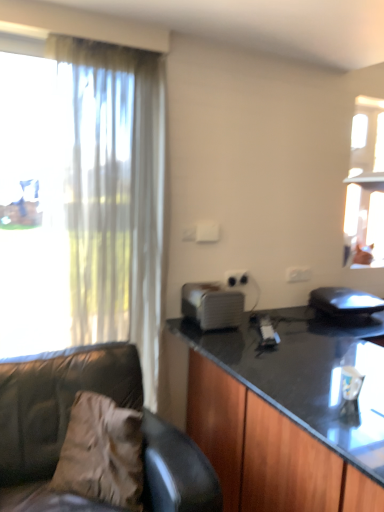
Locate an element on the screen. This screenshot has width=384, height=512. black plastic laptop at right, the first appliance positioned from the right is located at coordinates (344, 301).

The image size is (384, 512). What do you see at coordinates (236, 278) in the screenshot? I see `white plastic power outlet at center` at bounding box center [236, 278].

Where is `translucent fabric curtain at left`? Image resolution: width=384 pixels, height=512 pixels. translucent fabric curtain at left is located at coordinates (112, 193).

What is the approximate width of brown fabric pillow at lower left?

brown fabric pillow at lower left is 11.17 inches in width.

What do you see at coordinates (212, 305) in the screenshot? This screenshot has width=384, height=512. I see `white plastic toaster at center, positioned as the first appliance in left-to-right order` at bounding box center [212, 305].

What is the approximate height of white plastic toaster at center, positioned as the first appliance in left-to-right order?

It is 8.18 inches.

Locate an element on the screen. black plastic laptop at right, positioned as the second appliance in left-to-right order is located at coordinates pos(344,301).

Considering the positions of point (382, 304) and point (311, 465), is point (382, 304) closer or farther from the camera than point (311, 465)?

Clearly, point (382, 304) is more distant from the camera than point (311, 465).

From a real-world perspective, which is physically above, black plastic laptop at right, the first appliance positioned from the right, or black glossy cabinet at right?

In real-world perspective, black plastic laptop at right, the first appliance positioned from the right, is above.

Considering the relative positions of black plastic laptop at right, positioned as the second appliance in left-to-right order, and black glossy cabinet at right in the image provided, is black plastic laptop at right, positioned as the second appliance in left-to-right order, to the right of black glossy cabinet at right from the viewer's perspective?

Correct, you'll find black plastic laptop at right, positioned as the second appliance in left-to-right order, to the right of black glossy cabinet at right.

From the image's perspective, does black plastic laptop at right, the first appliance positioned from the right, appear lower than black glossy cabinet at right?

Actually, black plastic laptop at right, the first appliance positioned from the right, appears above black glossy cabinet at right in the image.

Looking at this image, from a real-world perspective, is translucent fabric curtain at left beneath black glossy cabinet at right?

No, from a real-world perspective, translucent fabric curtain at left is not beneath black glossy cabinet at right.

Which is nearer, (92, 188) or (312, 501)?

Point (92, 188) appears to be farther away from the viewer than point (312, 501).

Does translucent fabric curtain at left appear on the right side of black glossy cabinet at right?

No.

How far apart are translucent fabric curtain at left and black glossy cabinet at right?

translucent fabric curtain at left is 34.01 inches away from black glossy cabinet at right.

From the picture: Could you tell me if brown fabric pillow at lower left is turned towards translucent fabric curtain at left?

No.

From a real-world perspective, does brown fabric pillow at lower left stand above translucent fabric curtain at left?

No, from a real-world perspective, brown fabric pillow at lower left is not over translucent fabric curtain at left

Find the location of a particular element. This screenshot has width=384, height=512. pillow lying below the translucent fabric curtain at left (from the image's perspective) is located at coordinates (102, 452).

Can you see brown fabric pillow at lower left touching translucent fabric curtain at left?

No, brown fabric pillow at lower left is not next to translucent fabric curtain at left.

Is black plastic laptop at right, the first appliance positioned from the right, aimed at leather couch at left?

No, black plastic laptop at right, the first appliance positioned from the right, is not oriented towards leather couch at left.

Does black plastic laptop at right, positioned as the second appliance in left-to-right order, have a lesser height compared to leather couch at left?

Indeed, black plastic laptop at right, positioned as the second appliance in left-to-right order, has a lesser height compared to leather couch at left.

Measure the distance from black plastic laptop at right, positioned as the second appliance in left-to-right order, to leather couch at left.

5.24 feet.

In the scene shown: Is black plastic laptop at right, the first appliance positioned from the right, closer to the viewer compared to leather couch at left?

No, black plastic laptop at right, the first appliance positioned from the right, is further to the viewer.

From a real-world perspective, does white plastic toaster at center, positioned as the first appliance in left-to-right order, stand above white plastic power outlet at center?

No, from a real-world perspective, white plastic toaster at center, positioned as the first appliance in left-to-right order, is not over white plastic power outlet at center

Is white plastic toaster at center, positioned as the first appliance in left-to-right order, thinner than white plastic power outlet at center?

Incorrect, the width of white plastic toaster at center, positioned as the first appliance in left-to-right order, is not less than that of white plastic power outlet at center.

Does point (211, 319) come behind point (235, 275)?

No.

Find the location of a particular element. The width and height of the screenshot is (384, 512). the 2nd appliance in front of the white plastic power outlet at center, counting from the anchor's position is located at coordinates (212, 305).

Does point (230, 272) come farther from viewer compared to point (136, 402)?

Yes, point (230, 272) is farther from viewer.

Can you confirm if white plastic power outlet at center is thinner than leather couch at left?

Correct, the width of white plastic power outlet at center is less than that of leather couch at left.

Is white plastic power outlet at center directly adjacent to leather couch at left?

No.

Considering the relative sizes of white plastic power outlet at center and leather couch at left in the image provided, is white plastic power outlet at center taller than leather couch at left?

In fact, white plastic power outlet at center may be shorter than leather couch at left.

Consider the image. Is brown fabric pillow at lower left not within black plastic laptop at right, positioned as the second appliance in left-to-right order?

That's correct, brown fabric pillow at lower left is outside of black plastic laptop at right, positioned as the second appliance in left-to-right order.

Does brown fabric pillow at lower left appear on the left side of black plastic laptop at right, positioned as the second appliance in left-to-right order?

Yes, brown fabric pillow at lower left is to the left of black plastic laptop at right, positioned as the second appliance in left-to-right order.

From a real-world perspective, which is physically above, brown fabric pillow at lower left or black plastic laptop at right, the first appliance positioned from the right?

black plastic laptop at right, the first appliance positioned from the right, from a real-world perspective.

Which is behind, point (73, 436) or point (340, 293)?

The point (340, 293) is farther.

The height and width of the screenshot is (512, 384). I want to click on the 1st appliance above the black glossy cabinet at right (from a real-world perspective), so click(x=344, y=301).

Image resolution: width=384 pixels, height=512 pixels. In order to click on cabinetry located underneath the translucent fabric curtain at left (from a real-world perspective) in this screenshot , I will do `click(267, 451)`.

Based on their spatial positions, is translucent fabric curtain at left or leather couch at left further from black glossy cabinet at right?

translucent fabric curtain at left lies further to black glossy cabinet at right than the other object.

Considering their positions, is black plastic laptop at right, the first appliance positioned from the right, positioned further to leather couch at left than white plastic toaster at center, which appears as the second appliance when viewed from the right?

Among the two, black plastic laptop at right, the first appliance positioned from the right, is located further to leather couch at left.

From the image, which object appears to be farther from translucent fabric curtain at left, white plastic power outlet at center or brown fabric pillow at lower left?

The object further to translucent fabric curtain at left is white plastic power outlet at center.

Considering their positions, is brown fabric pillow at lower left positioned further to black plastic laptop at right, the first appliance positioned from the right, than black glossy cabinet at right?

brown fabric pillow at lower left.

Looking at the image, which one is located further to black plastic laptop at right, the first appliance positioned from the right, white plastic toaster at center, positioned as the first appliance in left-to-right order, or brown fabric pillow at lower left?

The object further to black plastic laptop at right, the first appliance positioned from the right, is brown fabric pillow at lower left.

Which object lies further to the anchor point white plastic power outlet at center, black glossy cabinet at right or white plastic toaster at center, which appears as the second appliance when viewed from the right?

black glossy cabinet at right.

Which object lies further to the anchor point brown fabric pillow at lower left, leather couch at left or black plastic laptop at right, the first appliance positioned from the right?

black plastic laptop at right, the first appliance positioned from the right, is further to brown fabric pillow at lower left.

From the image, which object appears to be farther from brown fabric pillow at lower left, black glossy cabinet at right or leather couch at left?

Among the two, black glossy cabinet at right is located further to brown fabric pillow at lower left.

At what (x,y) coordinates should I click in order to perform the action: click on power outlet situated between white plastic toaster at center, positioned as the first appliance in left-to-right order, and black plastic laptop at right, positioned as the second appliance in left-to-right order, from left to right. Please return your answer as a coordinate pair (x, y). The height and width of the screenshot is (512, 384). Looking at the image, I should click on (236, 278).

What are the coordinates of `pillow situated between leather couch at left and black glossy cabinet at right from left to right` in the screenshot? It's located at 102,452.

At what (x,y) coordinates should I click in order to perform the action: click on appliance between brown fabric pillow at lower left and black plastic laptop at right, the first appliance positioned from the right, in the horizontal direction. Please return your answer as a coordinate pair (x, y). Looking at the image, I should click on (212, 305).

Where is `appliance between translucent fabric curtain at left and black glossy cabinet at right from left to right`? appliance between translucent fabric curtain at left and black glossy cabinet at right from left to right is located at coordinates (212, 305).